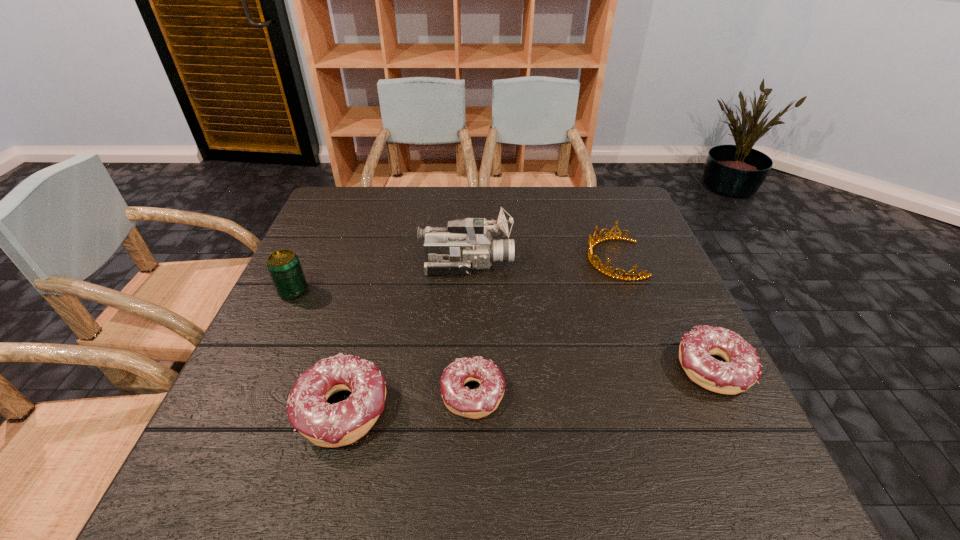
This screenshot has width=960, height=540. In order to click on vacant region located on the right of the shortest object in this screenshot , I will do pyautogui.click(x=660, y=395).

Where is `blank space located 0.250m on the back of the second tallest doughnut`? The width and height of the screenshot is (960, 540). blank space located 0.250m on the back of the second tallest doughnut is located at coordinates (662, 267).

Find the location of a particular element. The width and height of the screenshot is (960, 540). vacant space located on the front-facing side of the tallest object is located at coordinates pos(658,264).

You are a GUI agent. You are given a task and a screenshot of the screen. Output one action in this format:
    pyautogui.click(x=<x>, y=<y>)
    Task: Click on the blank space located on the front-facing side of the tiara
    The width and height of the screenshot is (960, 540).
    Given the screenshot: What is the action you would take?
    pyautogui.click(x=513, y=259)

Identify the location of vacant area situated 0.250m on the front-facing side of the tiara. The image size is (960, 540). (491, 259).

At what (x,y) coordinates should I click in order to perform the action: click on free region located 0.360m on the front-facing side of the tiara. Please return your answer as a coordinate pair (x, y). This screenshot has height=540, width=960. Looking at the image, I should click on (448, 259).

Locate an element on the screen. The width and height of the screenshot is (960, 540). free space located on the front of the leftmost object is located at coordinates (262, 359).

Find the location of `doughnut that is at the left edge`. doughnut that is at the left edge is located at coordinates (329, 425).

Image resolution: width=960 pixels, height=540 pixels. In order to click on beer can that is positioned at the left edge in this screenshot , I will do `click(284, 267)`.

Where is `doughnut that is positioned at the right edge`? The width and height of the screenshot is (960, 540). doughnut that is positioned at the right edge is located at coordinates (742, 369).